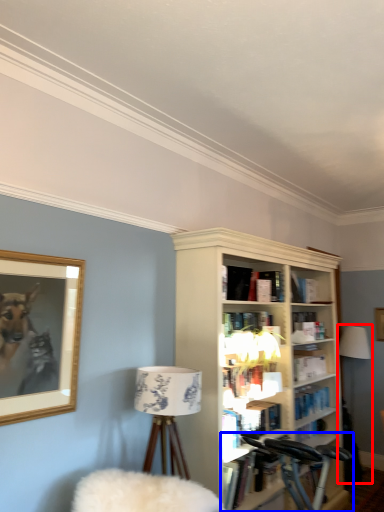
Question: Which of the following is the farthest to the observer, table lamp (highlighted by a red box) or bicycle (highlighted by a blue box)?

Choices:
 (A) table lamp
 (B) bicycle

Answer: (A)